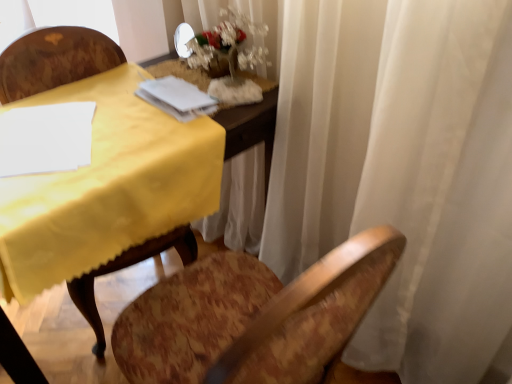
You are a GUI agent. You are given a task and a screenshot of the screen. Output one action in this format:
    pyautogui.click(x=<x>, y=<y>)
    Task: Click on the vacant area that lies in front of white paper at upper center
    This screenshot has height=384, width=512.
    Given the screenshot: What is the action you would take?
    pyautogui.click(x=148, y=134)